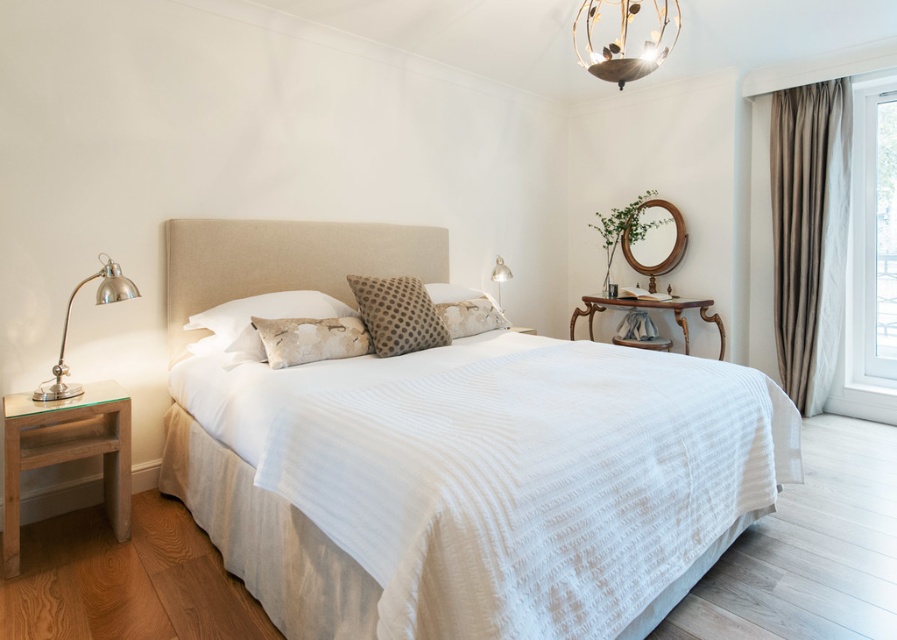
You are a photographer setting up a shoot in the bedroom. You need to position a 1.2m tall tripod between the white textured bed at center and the metallic silver lamp at upper right. Considering their heights, will the tripod be taller than both objects?

The white textured bed at center is taller than the metallic silver lamp at upper right. Since the tripod is 1.2m tall, it will only be taller than the metallic silver lamp at upper right if the bed is shorter than 1.2m. However, since the bed is taller than the lamp, but the exact height of the bed isn

You are a delivery person who needs to place a package between the white textured bed at center and the metallic silver lamp at upper right. The package measures 1.5 meters in length. Will there be enough space between them to fit the package?

The distance between the white textured bed at center and the metallic silver lamp at upper right is 1.84 meters. Since the package is 1.5 meters long, there is sufficient space to place it between them.

You are arranging flowers in this bedroom and want to place them on the bed. Which object between the beige fabric headboard at center and the white textured pillow at center would you place the flowers on if you prefer a larger surface area?

The beige fabric headboard at center is bigger than the white textured pillow at center, so you should place the flowers on the beige fabric headboard at center for a larger surface area.